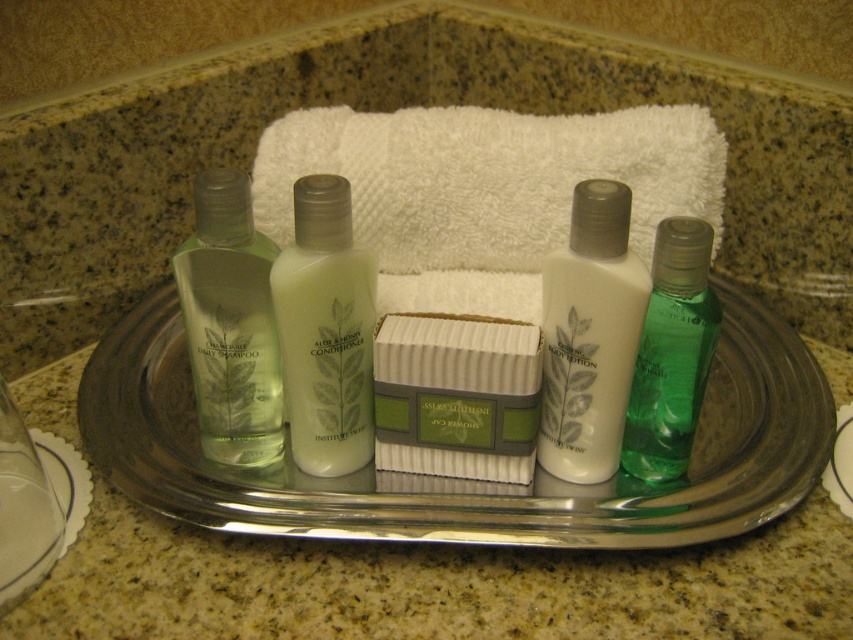
Question: Which point is closer to the camera taking this photo?

Choices:
 (A) (589, 310)
 (B) (10, 548)

Answer: (B)

Question: Estimate the real-world distances between objects in this image. Which object is closer to the green matte daily shampoo at left?

Choices:
 (A) white fluffy hand towel at center
 (B) clear plastic tray at center
 (C) green translucent lotion at right
 (D) white matte body lotion at center

Answer: (B)

Question: Can you confirm if clear plastic tray at center is bigger than white fluffy hand towel at center?

Choices:
 (A) no
 (B) yes

Answer: (B)

Question: Which point is closer to the camera taking this photo?

Choices:
 (A) (134, 468)
 (B) (618, 336)

Answer: (B)

Question: Can you confirm if clear plastic tray at center is positioned above white matte body lotion at center?

Choices:
 (A) no
 (B) yes

Answer: (A)

Question: Can you confirm if white striped soap at center is positioned to the left of green translucent lotion at right?

Choices:
 (A) no
 (B) yes

Answer: (B)